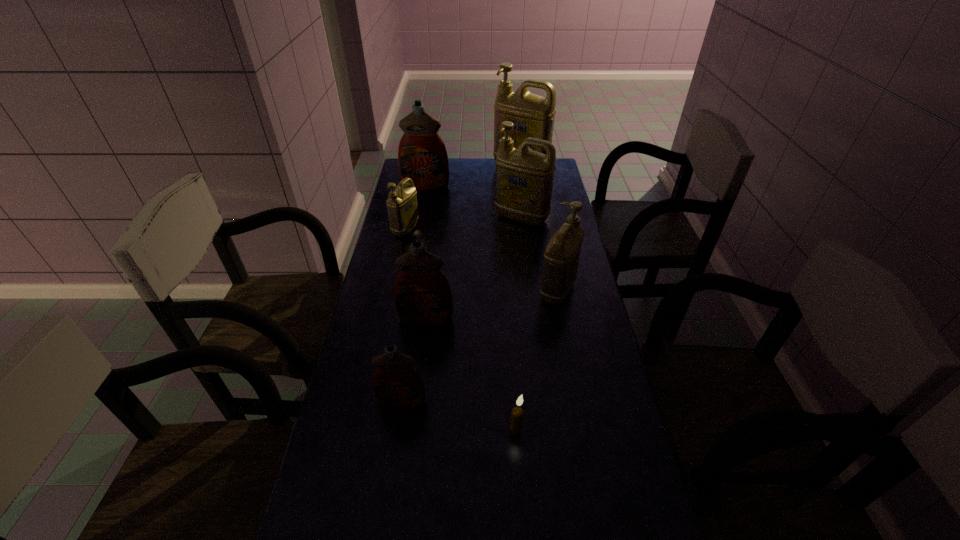
Image resolution: width=960 pixels, height=540 pixels. What are the coordinates of `the nearest object` in the screenshot? It's located at (517, 413).

Image resolution: width=960 pixels, height=540 pixels. I want to click on candle, so click(x=517, y=413).

Identify the location of vacant space located 0.220m on the front of the farthest object. (526, 206).

In order to click on free space located on the back of the third smallest beige detergent in this screenshot , I will do `click(516, 171)`.

Locate an element on the screen. The image size is (960, 540). vacant position located 0.320m on the front surface of the farthest red detergent is located at coordinates tap(417, 235).

Find the location of a particular element. vacant space located on the front of the nearest beige detergent is located at coordinates (566, 337).

Identify the location of vacant space located 0.380m on the front surface of the second smallest red detergent. This screenshot has height=540, width=960. (410, 447).

Where is `vacant space located on the front of the smallest beige detergent`? vacant space located on the front of the smallest beige detergent is located at coordinates (395, 285).

The image size is (960, 540). Find the location of `vacant region located on the front surface of the second nearest object`. vacant region located on the front surface of the second nearest object is located at coordinates (395, 445).

Find the location of a particular element. This screenshot has width=960, height=540. vacant space positioned 0.370m on the back of the shortest object is located at coordinates (509, 314).